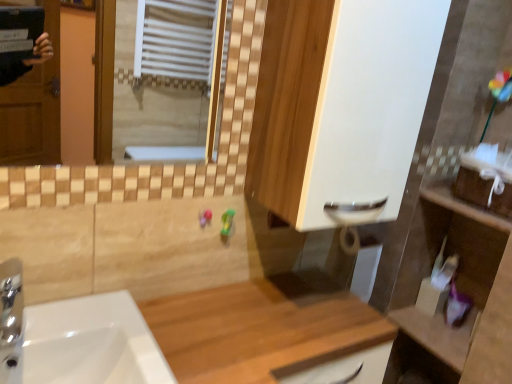
What do you see at coordinates (341, 107) in the screenshot?
I see `white matte cabinet at center` at bounding box center [341, 107].

What do you see at coordinates (457, 287) in the screenshot? The width and height of the screenshot is (512, 384). I see `wooden shelf at right` at bounding box center [457, 287].

Where is `chrome metallic tap at lower left`? The width and height of the screenshot is (512, 384). chrome metallic tap at lower left is located at coordinates (11, 320).

Between wooden shelf at right and chrome metallic tap at lower left, which one has smaller width?

wooden shelf at right.

From the image's perspective, is wooden shelf at right positioned above or below chrome metallic tap at lower left?

wooden shelf at right is below chrome metallic tap at lower left.

Is wooden shelf at right turned away from chrome metallic tap at lower left?

No, wooden shelf at right's orientation is not away from chrome metallic tap at lower left.

Who is smaller, white glossy sink at lower left or wooden at center?

white glossy sink at lower left.

Is white glossy sink at lower left positioned beyond the bounds of wooden at center?

No.

Is white glossy sink at lower left wider than wooden shelf at right?

Indeed, white glossy sink at lower left has a greater width compared to wooden shelf at right.

Considering the relative sizes of white glossy sink at lower left and wooden shelf at right in the image provided, is white glossy sink at lower left smaller than wooden shelf at right?

Correct, white glossy sink at lower left occupies less space than wooden shelf at right.

Is point (29, 382) more distant than point (397, 357)?

No, it is not.

Would you say wooden shelf at right is inside or outside white glossy sink at lower left?

wooden shelf at right exists outside the volume of white glossy sink at lower left.

From a real-world perspective, is wooden shelf at right on top of white glossy sink at lower left?

No, from a real-world perspective, wooden shelf at right is not on top of white glossy sink at lower left.

Would you consider wooden shelf at right to be distant from white glossy sink at lower left?

That's not correct — wooden shelf at right is a little close to white glossy sink at lower left.

Does point (327, 94) appear closer or farther from the camera than point (22, 269)?

Point (327, 94).

Based on the photo, do you think white matte cabinet at center is within chrome metallic tap at lower left, or outside of it?

white matte cabinet at center is outside chrome metallic tap at lower left.

From a real-world perspective, does white matte cabinet at center stand above chrome metallic tap at lower left?

Yes, from a real-world perspective, white matte cabinet at center is on top of chrome metallic tap at lower left.

Considering the points (233, 313) and (318, 179), which point is behind, point (233, 313) or point (318, 179)?

The point (233, 313) is behind.

From the image's perspective, between wooden at center and white matte cabinet at center, who is located below?

From the image's view, wooden at center is below.

Are wooden at center and white matte cabinet at center beside each other?

No, wooden at center is not next to white matte cabinet at center.

Considering the positions of objects wooden at center and white matte cabinet at center in the image provided, who is behind, wooden at center or white matte cabinet at center?

white matte cabinet at center is behind.

Which object is wider, chrome metallic tap at lower left or white matte cabinet at center?

white matte cabinet at center is wider.

Which is more distant, [16,308] or [364,222]?

The point [364,222] is farther.

Could you tell me if chrome metallic tap at lower left is turned towards white matte cabinet at center?

No, chrome metallic tap at lower left is not aimed at white matte cabinet at center.

Consider the image. Considering their positions, is chrome metallic tap at lower left located in front of or behind white matte cabinet at center?

chrome metallic tap at lower left is positioned closer to the viewer than white matte cabinet at center.

Where is `counter located below the chrome metallic tap at lower left (from the image's perspective)`? The height and width of the screenshot is (384, 512). counter located below the chrome metallic tap at lower left (from the image's perspective) is located at coordinates (457, 287).

At what (x,y) coordinates should I click in order to perform the action: click on sink above the wooden at center (from the image's perspective). Please return your answer as a coordinate pair (x, y). Looking at the image, I should click on point(76,339).

From the image, which object appears to be nearer to chrome metallic tap at lower left, white matte cabinet at center or wooden at center?

Among the two, wooden at center is located nearer to chrome metallic tap at lower left.

Considering their positions, is white glossy sink at lower left positioned closer to white matte cabinet at center than chrome metallic tap at lower left?

white glossy sink at lower left lies closer to white matte cabinet at center than the other object.

Based on their spatial positions, is white matte cabinet at center or wooden at center further from white glossy sink at lower left?

white matte cabinet at center.

Looking at the image, which one is located closer to wooden at center, chrome metallic tap at lower left or white glossy sink at lower left?

white glossy sink at lower left is positioned closer to the anchor wooden at center.

From the image, which object appears to be nearer to wooden shelf at right, wooden at center or white matte cabinet at center?

wooden at center.

Looking at the image, which one is located closer to wooden shelf at right, white glossy sink at lower left or wooden at center?

wooden at center lies closer to wooden shelf at right than the other object.

Based on their spatial positions, is white glossy sink at lower left or wooden shelf at right further from wooden at center?

wooden shelf at right.

From the image, which object appears to be farther from wooden at center, white matte cabinet at center or wooden shelf at right?

Among the two, white matte cabinet at center is located further to wooden at center.

I want to click on counter top between chrome metallic tap at lower left and wooden shelf at right in the horizontal direction, so click(262, 328).

Where is `cabinetry between white glossy sink at lower left and wooden shelf at right in the horizontal direction`? cabinetry between white glossy sink at lower left and wooden shelf at right in the horizontal direction is located at coordinates (341, 107).

Find the location of `counter top between white glossy sink at lower left and wooden shelf at right from left to right`. counter top between white glossy sink at lower left and wooden shelf at right from left to right is located at coordinates click(x=262, y=328).

Identify the location of sink between white matte cabinet at center and wooden at center from top to bottom. (76, 339).